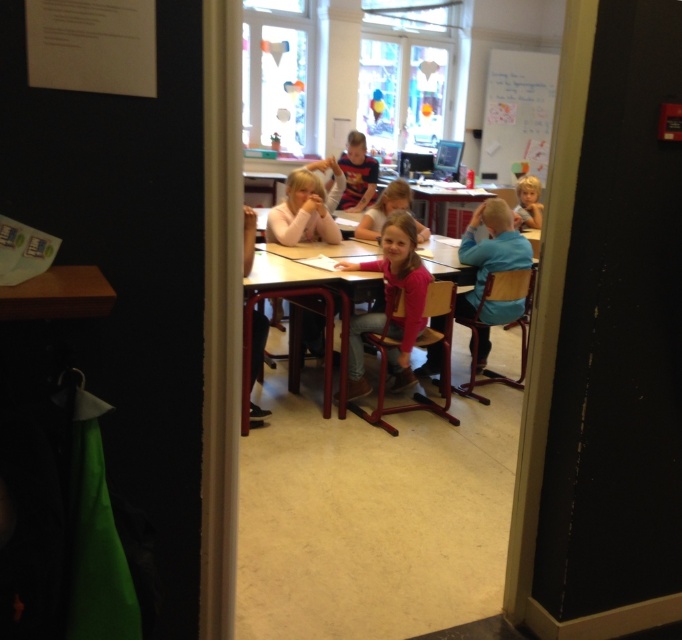
Question: Among these points, which one is farthest from the camera?

Choices:
 (A) (273, 252)
 (B) (421, 228)
 (C) (402, 225)

Answer: (B)

Question: Which point is farther from the camera taking this photo?

Choices:
 (A) (411, 298)
 (B) (372, 209)
 (C) (291, 280)
 (D) (537, 90)

Answer: (D)

Question: Among these objects, which one is nearest to the camera?

Choices:
 (A) whiteboard at upper right
 (B) pink fabric shirt at center

Answer: (B)

Question: Is pink fabric shirt at center to the left of blonde hair at right from the viewer's perspective?

Choices:
 (A) yes
 (B) no

Answer: (A)

Question: In this image, where is pink matte shirt at center located relative to pink fabric shirt at center?

Choices:
 (A) above
 (B) below

Answer: (B)

Question: Does whiteboard at upper right come behind wooden table at center?

Choices:
 (A) yes
 (B) no

Answer: (A)